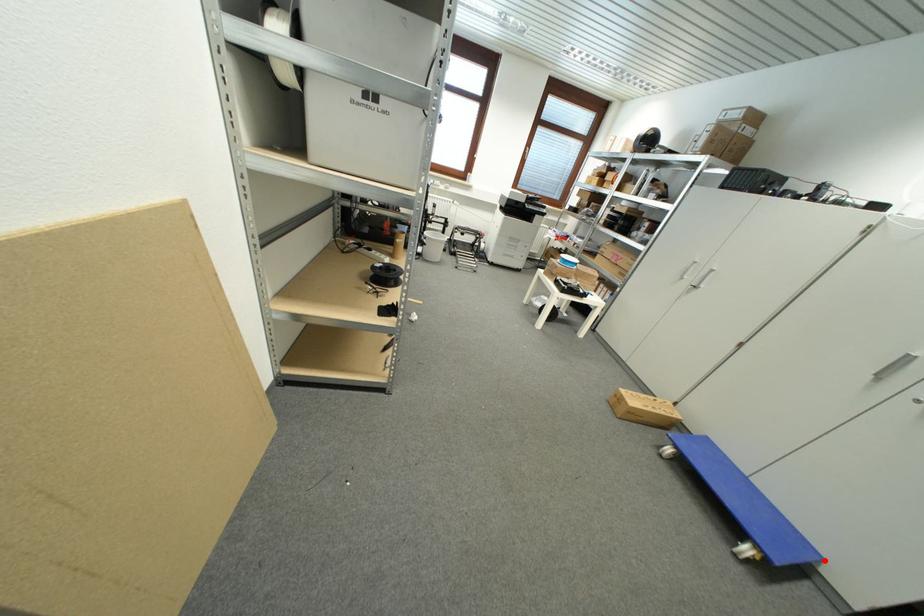
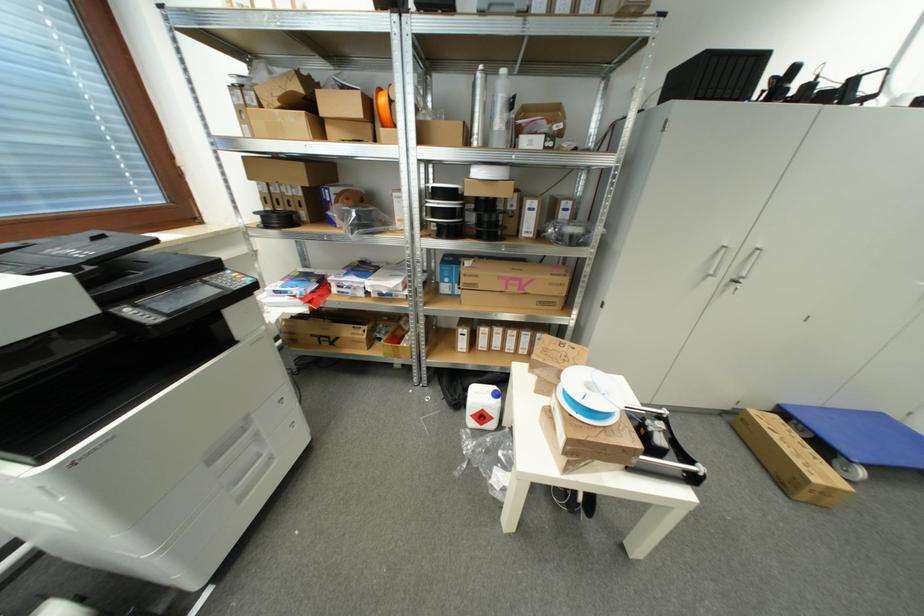
Question: I am providing you with two images of the same scene from different viewpoints. In image1, a red point is highlighted. Considering the same 3D point in image2, which of the following is correct?

Choices:
 (A) It is closer
 (B) It is farther

Answer: (A)